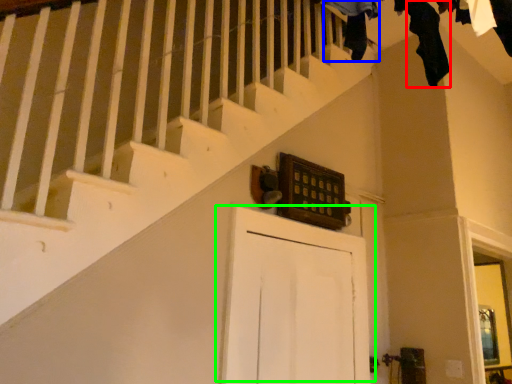
Question: Estimate the real-world distances between objects in this image. Which object is closer to clothing (highlighted by a red box), clothing (highlighted by a blue box) or door (highlighted by a green box)?

Choices:
 (A) clothing
 (B) door

Answer: (A)